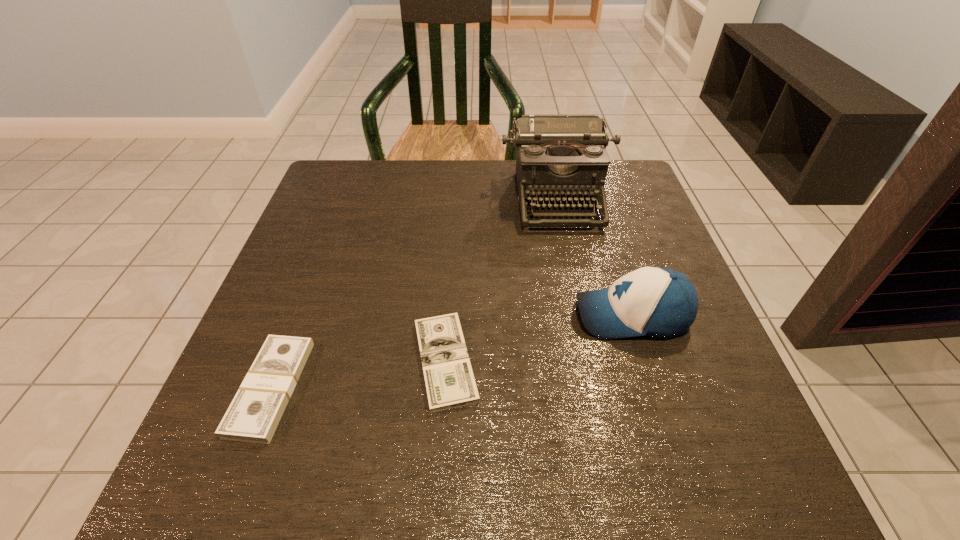
In order to click on vacant area in the image that satisfies the following two spatial constraints: 1. on the front-facing side of the third shortest object; 2. on the front side of the right dollar in this screenshot , I will do pos(646,361).